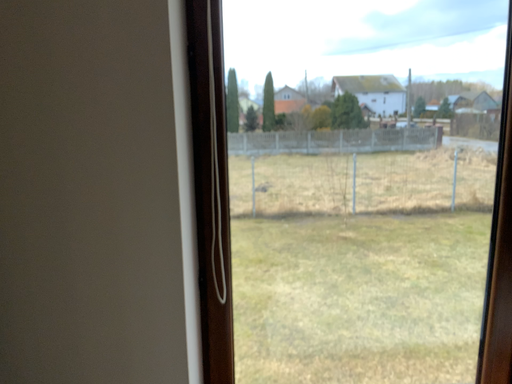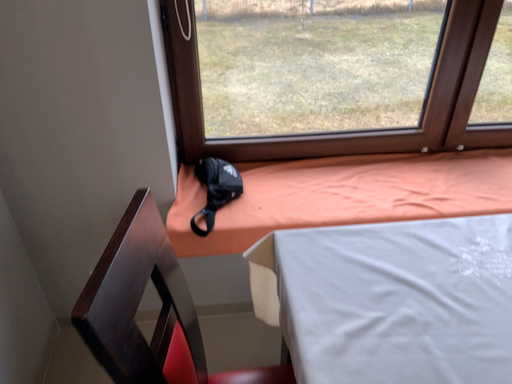
Question: Which way did the camera rotate in the video?

Choices:
 (A) rotated upward
 (B) rotated downward

Answer: (B)